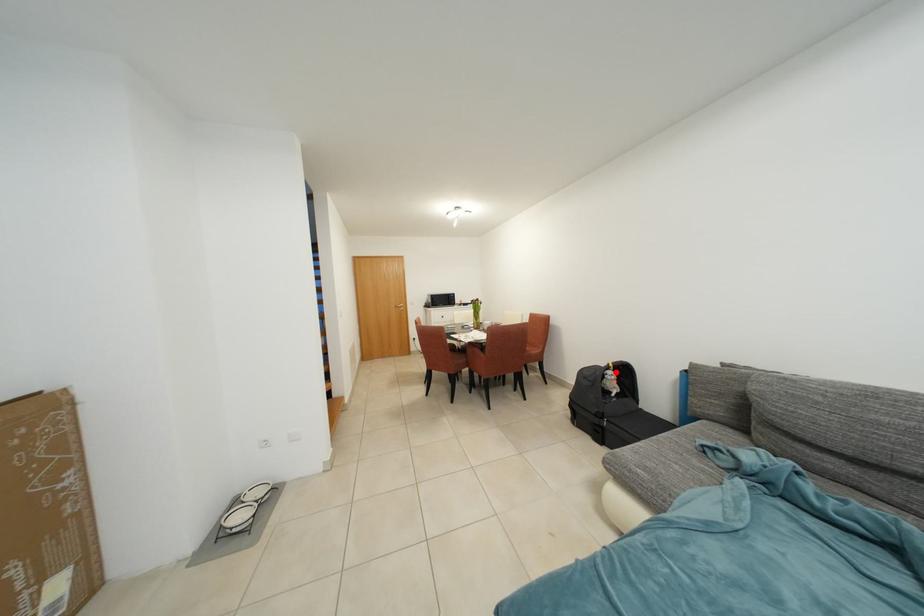
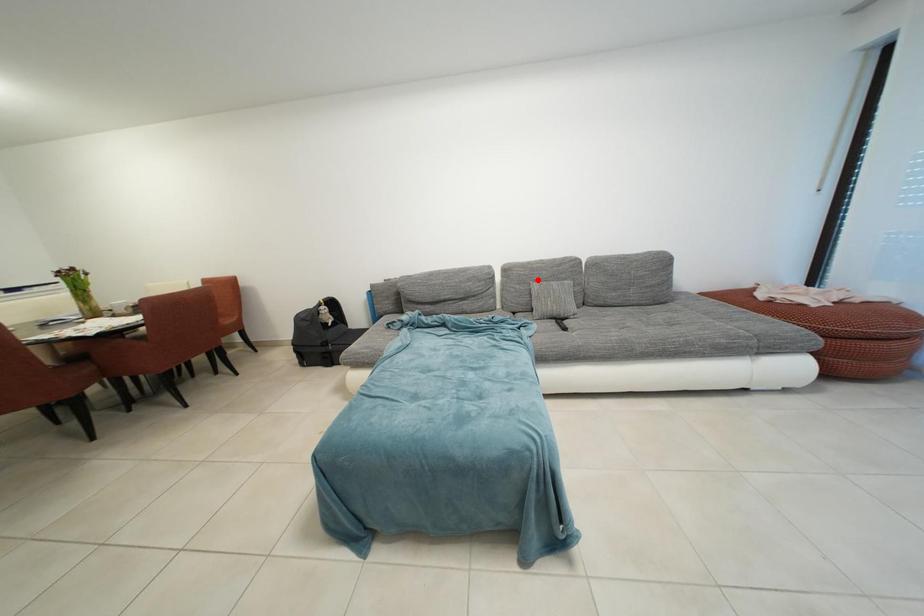
I am providing you with two images of the same scene from different viewpoints. A red point is marked on the first image and another point is marked on the second image. Do the highlighted points in image1 and image2 indicate the same real-world spot?

No